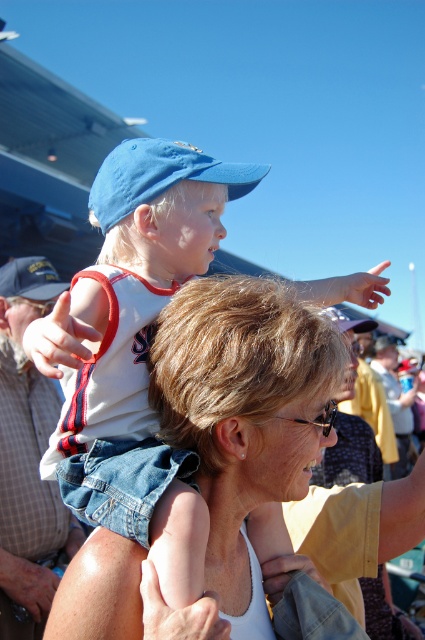
You are a photographer trying to capture a photo of the blue fabric baseball cap at upper center and the matte blue baseball cap at upper left in the same frame. The camera you have can only focus on objects within a 2 meter range. Will both caps be in focus?

The blue fabric baseball cap at upper center and matte blue baseball cap at upper left are 2.12 meters apart, which exceeds the camera focus range of 2 meters. Therefore, both caps cannot be in focus simultaneously.

You are a photographer trying to capture a clear shot of the child on the woman. You notice two blue caps in the frame. The matte blue cap at upper left and the blue fabric baseball cap at upper center. Which blue cap is more likely to block your view of the child?

The matte blue cap at upper left is more likely to block your view of the child because it is much taller than the blue fabric baseball cap at upper center.